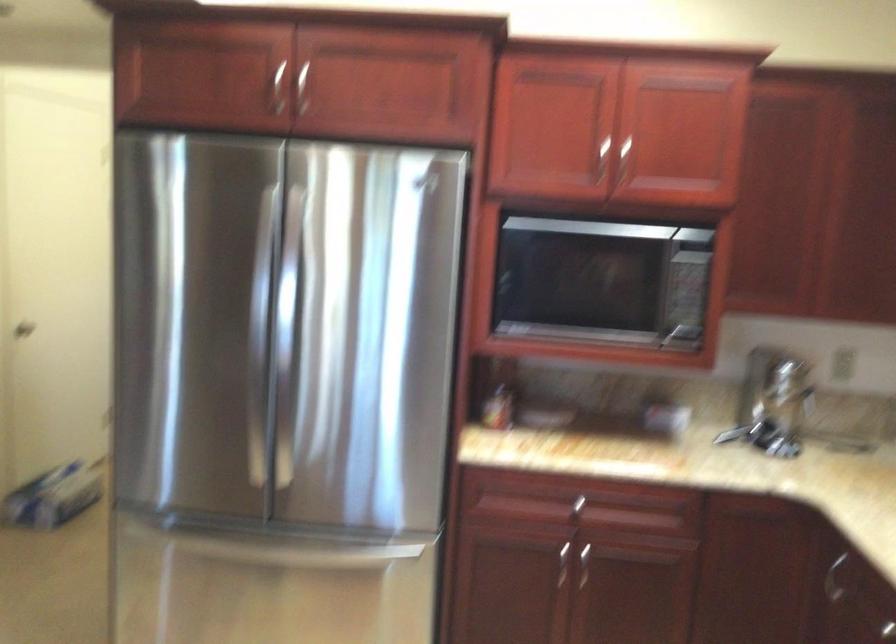
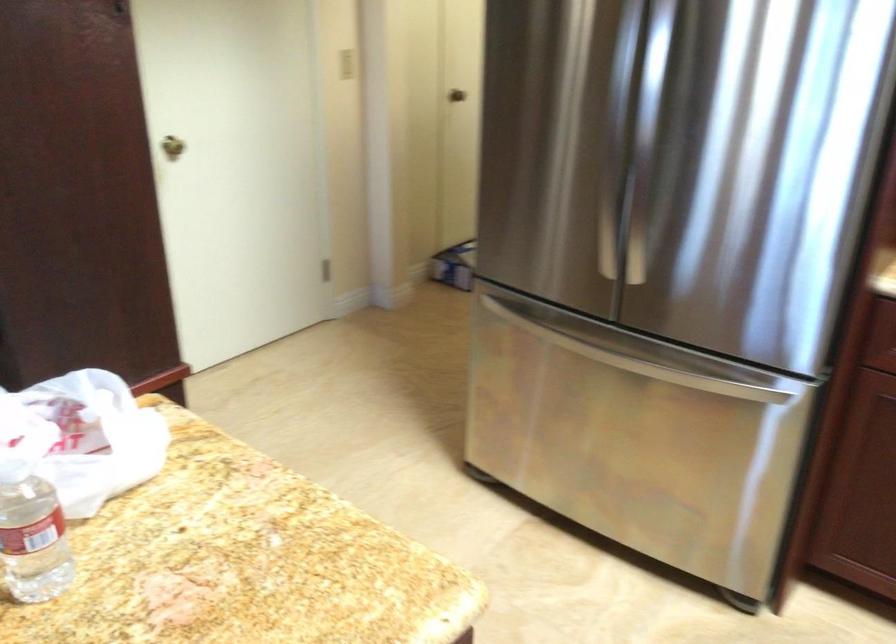
In the second image, find the point that corresponds to the point at 278,544 in the first image.

(607, 355)